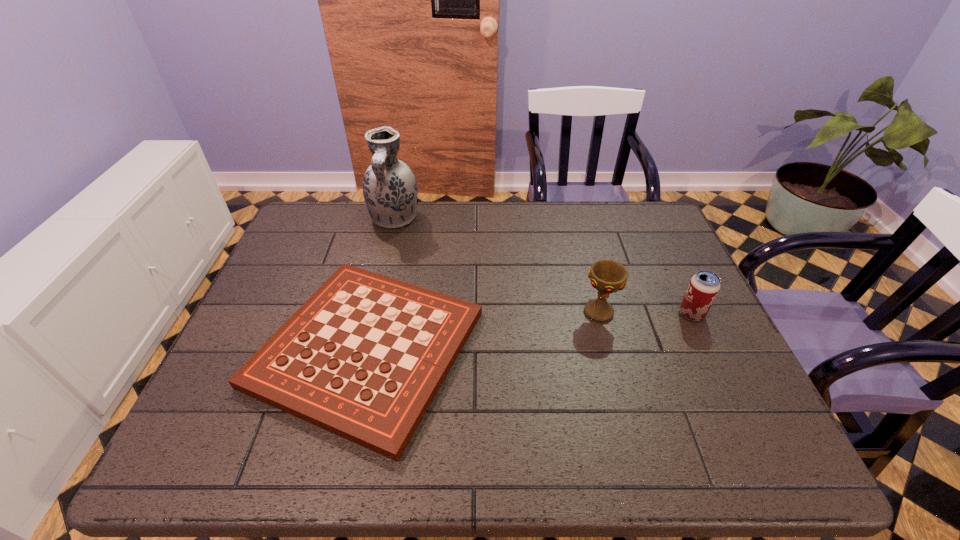
This screenshot has width=960, height=540. Find the location of `the third closest object to the shortest object`. the third closest object to the shortest object is located at coordinates (704, 286).

This screenshot has height=540, width=960. What are the coordinates of `free space in the image that satisfies the following two spatial constraints: 1. with the handle on the side of the farthest object; 2. on the right side of the chalice` in the screenshot? It's located at (372, 312).

At what (x,y) coordinates should I click in order to perform the action: click on blank area in the image that satisfies the following two spatial constraints: 1. with the handle on the side of the tallest object; 2. on the right side of the gameboard. Please return your answer as a coordinate pair (x, y). This screenshot has width=960, height=540. Looking at the image, I should click on pyautogui.click(x=363, y=349).

The image size is (960, 540). Find the location of `vacant space that satisfies the following two spatial constraints: 1. with the handle on the side of the chalice; 2. on the right side of the vase`. vacant space that satisfies the following two spatial constraints: 1. with the handle on the side of the chalice; 2. on the right side of the vase is located at coordinates click(x=372, y=312).

You are a GUI agent. You are given a task and a screenshot of the screen. Output one action in this format:
    pyautogui.click(x=<x>, y=<y>)
    Task: Click on the free location that satisfies the following two spatial constraints: 1. with the handle on the side of the beer can; 2. on the left side of the vase
    
    Given the screenshot: What is the action you would take?
    pyautogui.click(x=372, y=314)

The width and height of the screenshot is (960, 540). Find the location of `vacant area in the image that satisfies the following two spatial constraints: 1. with the handle on the side of the tallest object; 2. on the right side of the beer can`. vacant area in the image that satisfies the following two spatial constraints: 1. with the handle on the side of the tallest object; 2. on the right side of the beer can is located at coordinates (372, 314).

Image resolution: width=960 pixels, height=540 pixels. I want to click on free location that satisfies the following two spatial constraints: 1. with the handle on the side of the second object from right to left; 2. on the right side of the vase, so click(x=372, y=312).

In order to click on vacant position in the image that satisfies the following two spatial constraints: 1. with the handle on the side of the vase; 2. on the right side of the beer can in this screenshot , I will do `click(372, 314)`.

Where is `vacant space that satisfies the following two spatial constraints: 1. with the handle on the side of the vase; 2. on the right side of the second object from right to left`? The image size is (960, 540). vacant space that satisfies the following two spatial constraints: 1. with the handle on the side of the vase; 2. on the right side of the second object from right to left is located at coordinates (372, 312).

Where is `vacant area in the image that satisfies the following two spatial constraints: 1. with the handle on the side of the rightmost object; 2. on the right side of the vase`? The height and width of the screenshot is (540, 960). vacant area in the image that satisfies the following two spatial constraints: 1. with the handle on the side of the rightmost object; 2. on the right side of the vase is located at coordinates (372, 314).